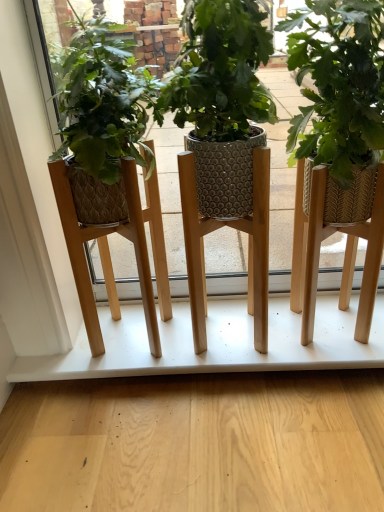
Question: Can you confirm if green woven basket at center is taller than white matte shelf at center?

Choices:
 (A) no
 (B) yes

Answer: (B)

Question: Does green woven basket at center have a lesser height compared to white matte shelf at center?

Choices:
 (A) no
 (B) yes

Answer: (A)

Question: Does green woven basket at center turn towards white matte shelf at center?

Choices:
 (A) no
 (B) yes

Answer: (A)

Question: Is green woven basket at center thinner than white matte shelf at center?

Choices:
 (A) yes
 (B) no

Answer: (A)

Question: From the image's perspective, is green woven basket at center over white matte shelf at center?

Choices:
 (A) yes
 (B) no

Answer: (A)

Question: Would you say green woven basket at center is a long distance from white matte shelf at center?

Choices:
 (A) no
 (B) yes

Answer: (A)

Question: Can green woven basket at center be found inside white matte shelf at center?

Choices:
 (A) yes
 (B) no

Answer: (B)

Question: Is the position of white matte shelf at center less distant than that of green woven basket at center?

Choices:
 (A) yes
 (B) no

Answer: (B)

Question: Is white matte shelf at center shorter than green woven basket at center?

Choices:
 (A) no
 (B) yes

Answer: (B)

Question: From a real-world perspective, is white matte shelf at center below green woven basket at center?

Choices:
 (A) no
 (B) yes

Answer: (B)

Question: From the image's perspective, would you say white matte shelf at center is shown under green woven basket at center?

Choices:
 (A) no
 (B) yes

Answer: (B)

Question: Is white matte shelf at center positioned behind green woven basket at center?

Choices:
 (A) yes
 (B) no

Answer: (A)

Question: Considering the positions of green woven basket at center and white matte shelf at center in the image, is green woven basket at center wider or thinner than white matte shelf at center?

Choices:
 (A) wide
 (B) thin

Answer: (B)